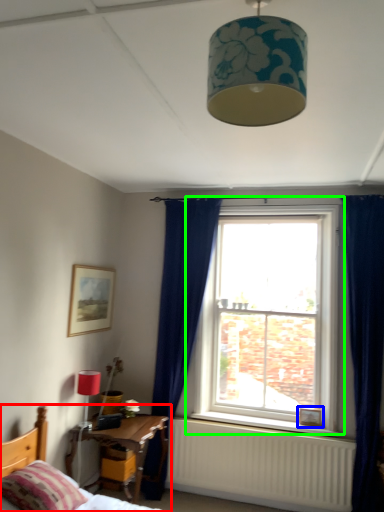
Question: Estimate the real-world distances between objects in this image. Which object is farther from bed (highlighted by a red box), picture frame (highlighted by a blue box) or window (highlighted by a green box)?

Choices:
 (A) picture frame
 (B) window

Answer: (A)